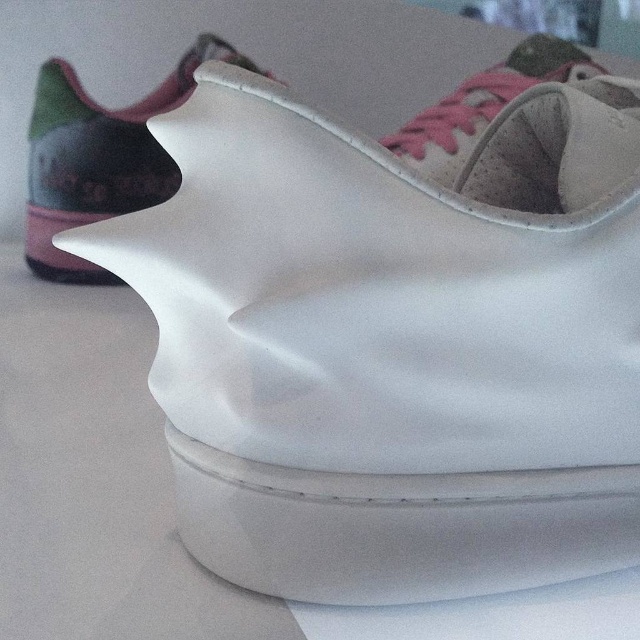
Consider the image. Does white matte shoe at upper center have a larger size compared to suede pink shoe at upper center?

Actually, white matte shoe at upper center might be smaller than suede pink shoe at upper center.

Which is more to the left, white matte shoe at upper center or suede pink shoe at upper center?

white matte shoe at upper center

The height and width of the screenshot is (640, 640). In order to click on white matte shoe at upper center in this screenshot , I will do `click(99, 157)`.